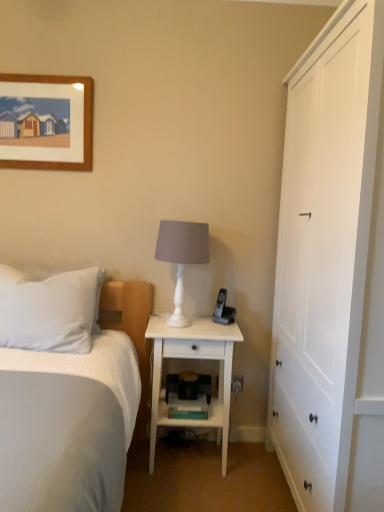
Question: From the image's perspective, is white textured bed at left below black plastic phone at right?

Choices:
 (A) no
 (B) yes

Answer: (B)

Question: From a real-world perspective, is white textured bed at left on top of black plastic phone at right?

Choices:
 (A) no
 (B) yes

Answer: (A)

Question: Is white textured bed at left facing towards black plastic phone at right?

Choices:
 (A) no
 (B) yes

Answer: (A)

Question: Could black plastic phone at right be considered to be inside white textured bed at left?

Choices:
 (A) no
 (B) yes

Answer: (A)

Question: Considering the relative positions of white textured bed at left and black plastic phone at right in the image provided, is white textured bed at left to the left of black plastic phone at right from the viewer's perspective?

Choices:
 (A) yes
 (B) no

Answer: (A)

Question: From a real-world perspective, relative to white textured bed at left, is white soft pillow at left vertically above or below?

Choices:
 (A) above
 (B) below

Answer: (A)

Question: From the image's perspective, is white soft pillow at left positioned above or below white textured bed at left?

Choices:
 (A) above
 (B) below

Answer: (A)

Question: Based on their sizes in the image, would you say white soft pillow at left is bigger or smaller than white textured bed at left?

Choices:
 (A) small
 (B) big

Answer: (A)

Question: Relative to white textured bed at left, is white soft pillow at left in front or behind?

Choices:
 (A) behind
 (B) front

Answer: (A)

Question: Is white soft pillow at left taller or shorter than white wood cabinet at right?

Choices:
 (A) short
 (B) tall

Answer: (A)

Question: Is white soft pillow at left inside the boundaries of white wood cabinet at right, or outside?

Choices:
 (A) outside
 (B) inside

Answer: (A)

Question: Considering the positions of white soft pillow at left and white wood cabinet at right in the image, is white soft pillow at left bigger or smaller than white wood cabinet at right?

Choices:
 (A) small
 (B) big

Answer: (A)

Question: Visually, is white soft pillow at left positioned to the left or to the right of white wood cabinet at right?

Choices:
 (A) right
 (B) left

Answer: (B)

Question: Considering the positions of white soft pillow at left and black plastic phone at right in the image, is white soft pillow at left wider or thinner than black plastic phone at right?

Choices:
 (A) wide
 (B) thin

Answer: (A)

Question: Is point (44, 316) positioned closer to the camera than point (223, 322)?

Choices:
 (A) closer
 (B) farther

Answer: (A)